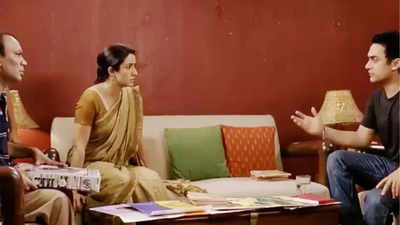
Image resolution: width=400 pixels, height=225 pixels. What are the coordinates of `book` in the screenshot? It's located at (59, 180).